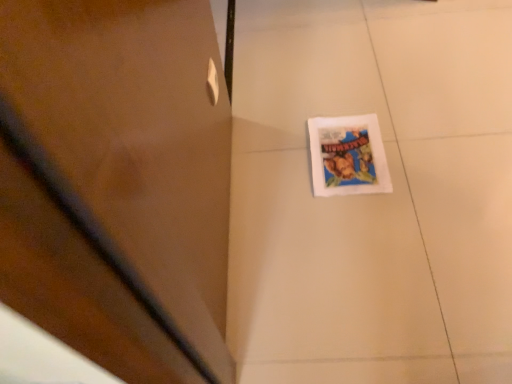
Locate an element on the screen. The height and width of the screenshot is (384, 512). white paper flyer at center is located at coordinates [x=348, y=156].

Describe the element at coordinates (348, 156) in the screenshot. I see `white paper flyer at center` at that location.

This screenshot has height=384, width=512. I want to click on white paper flyer at center, so click(348, 156).